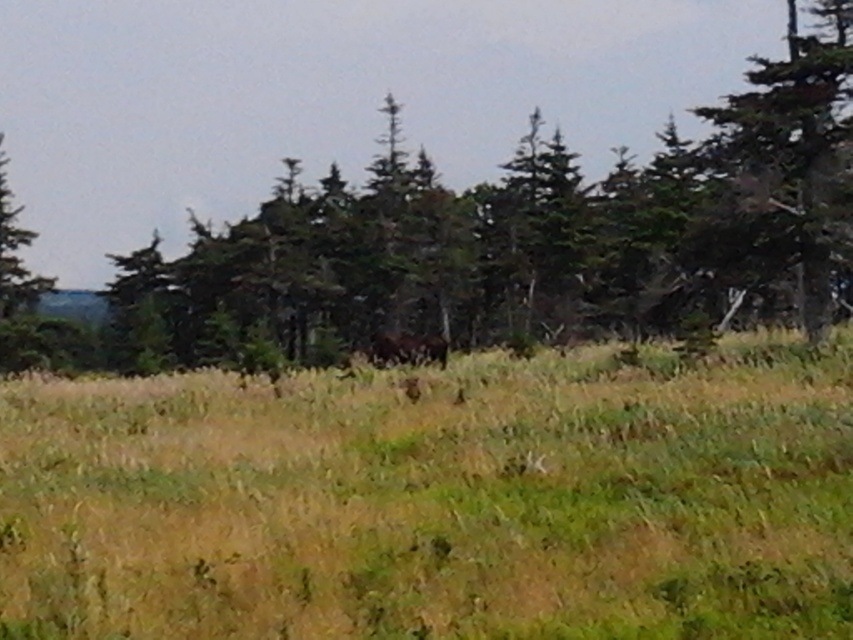
You are a hiker with a 25 meter long rope. You want to use it to cross a gap between the green grassy pasture at center and the green textured trees at upper center. Can you safely cross the gap using the rope?

The distance between the green grassy pasture at center and the green textured trees at upper center is 30.76 meters. Since the rope is only 25 meters long, it is not long enough to safely span the gap between the green grassy pasture at center and the green textured trees at upper center.

You are standing in the natural landscape described. You want to walk from your current position to the green textured tree at right. Which direction should you move relative to the green grassy pasture at center?

You should move towards the green textured tree at right, which is behind the green grassy pasture at center. Since the green grassy pasture at center is closer to you, you need to walk past it or around it to reach the tree.